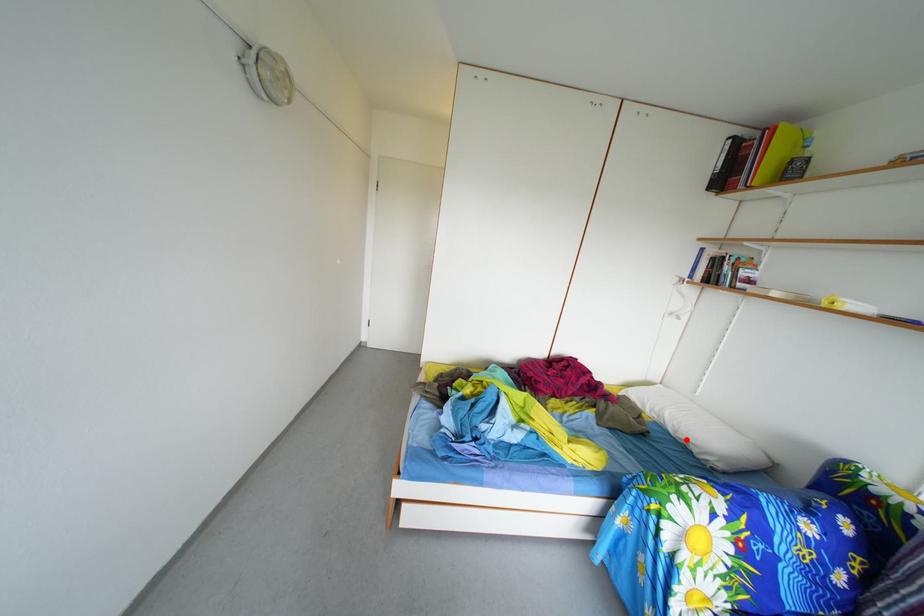
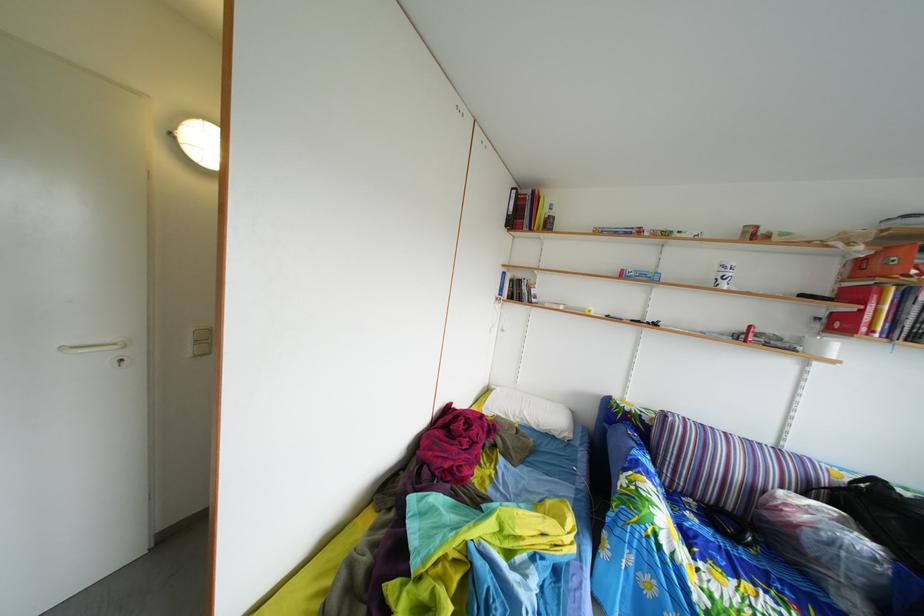
Question: I am providing you with two images of the same scene from different viewpoints. Image1 has a red point marked. In image2, the corresponding 3D location appears at what relative position? Reply with the corresponding letter.

Choices:
 (A) Closer
 (B) Farther

Answer: (B)